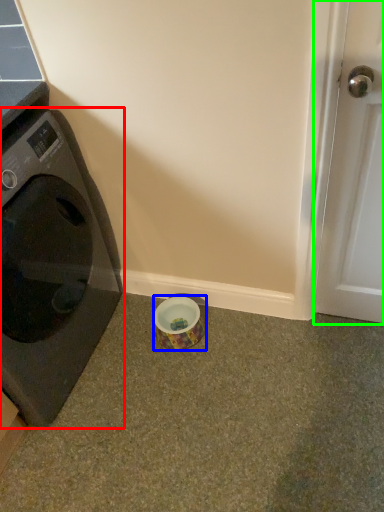
Question: Based on their relative distances, which object is nearer to washing machine (highlighted by a red box)? Choose from tape (highlighted by a blue box) and door (highlighted by a green box).

Choices:
 (A) tape
 (B) door

Answer: (A)